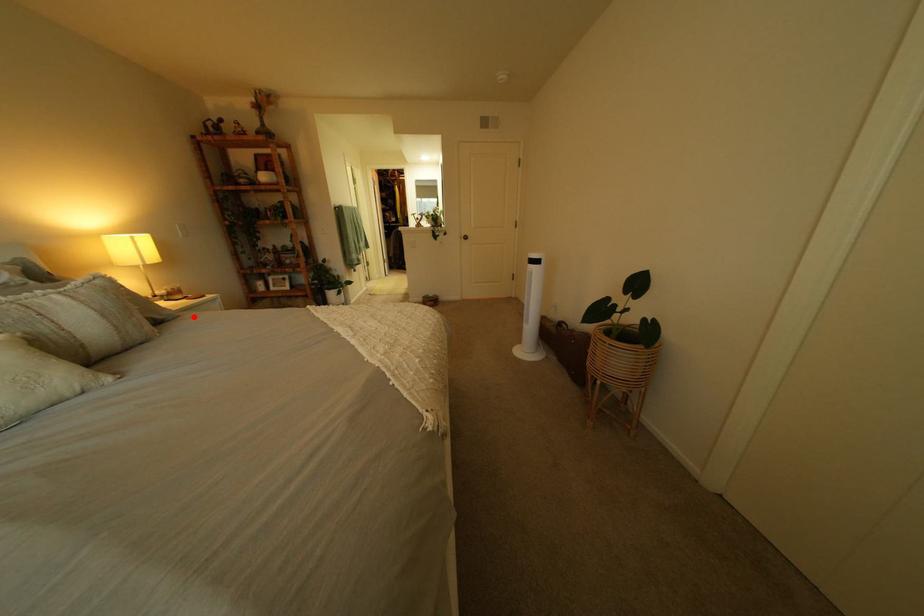
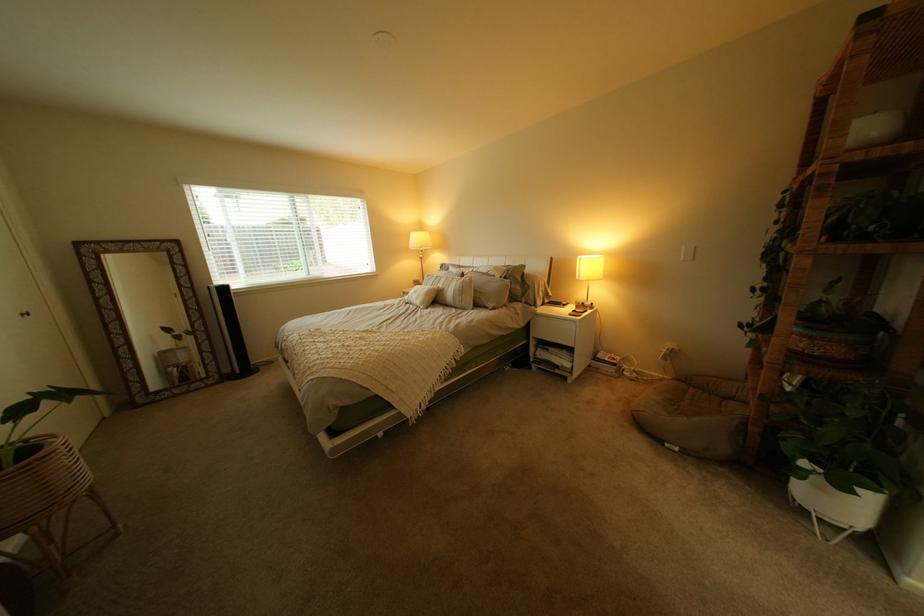
Where in the second image is the point corresponding to the highlighted location from the first image?

(509, 310)